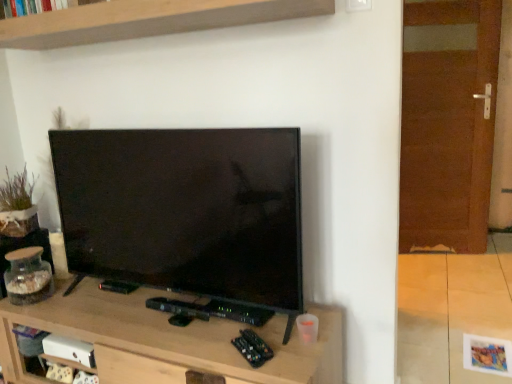
The height and width of the screenshot is (384, 512). I want to click on vacant point to the right of clear glass jar at left, so click(77, 284).